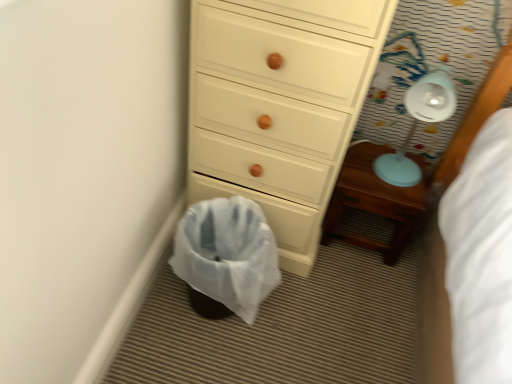
Locate an element on the screen. This screenshot has height=384, width=512. vacant area situated to the left side of white plastic lamp at upper right is located at coordinates (357, 168).